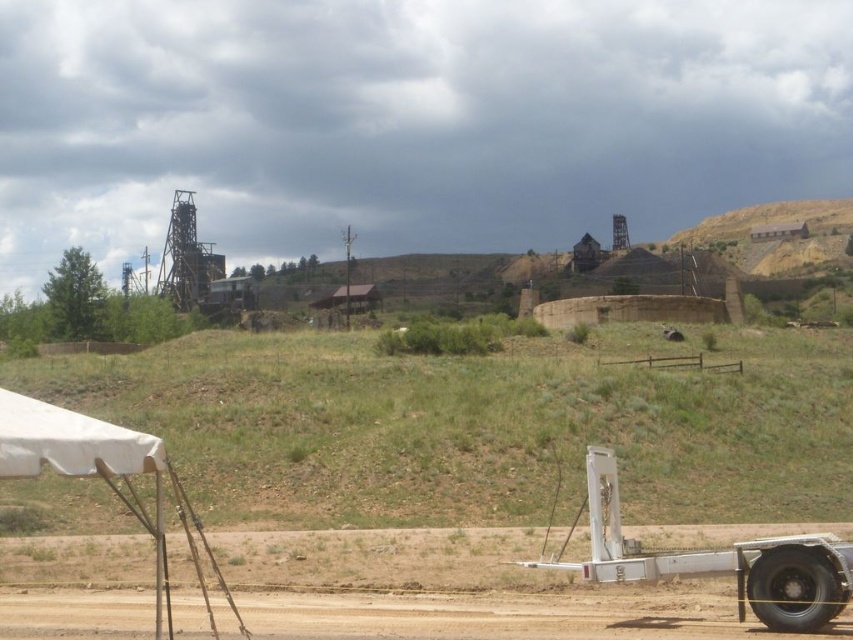
You are standing at the point marked by the coordinates point (718, 561) in the image. Looking around, you see the white metallic trailer truck at lower right. What is the nearest object to you in this scene?

The nearest object to you is the white metallic trailer truck at lower right because the point (718, 561) indicates its location.

From the picture: You are a hiker planning to set up a tent on the dirt track at lower left. However, there is a white canvas canopy at lower left already present. Can you set up your tent there without moving the existing canopy?

The dirt track at lower left is positioned under the white canvas canopy at lower left, so you can set up your tent there as the canopy is already covering the track.